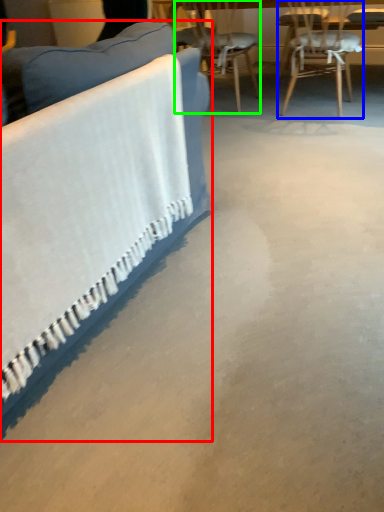
Question: Which object is the closest to the studio couch (highlighted by a red box)? Choose among these: chair (highlighted by a blue box) or chair (highlighted by a green box).

Choices:
 (A) chair
 (B) chair

Answer: (A)